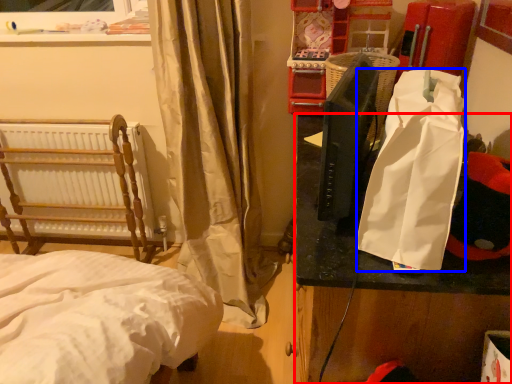
Question: Among these objects, which one is nearest to the camera, table (highlighted by a red box) or shopping bag (highlighted by a blue box)?

Choices:
 (A) table
 (B) shopping bag

Answer: (B)